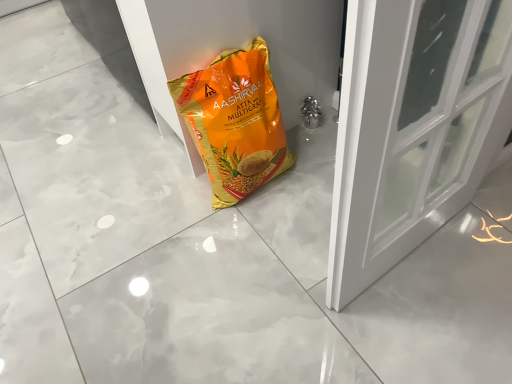
Question: Choose the correct answer: Is orange matte plastic bag at center inside white glossy door at center or outside it?

Choices:
 (A) outside
 (B) inside

Answer: (A)

Question: Considering the positions of orange matte plastic bag at center and white glossy door at center in the image, is orange matte plastic bag at center wider or thinner than white glossy door at center?

Choices:
 (A) wide
 (B) thin

Answer: (B)

Question: In terms of height, does orange matte plastic bag at center look taller or shorter compared to white glossy door at center?

Choices:
 (A) short
 (B) tall

Answer: (B)

Question: Based on their positions, is white glossy door at center located to the left or right of orange matte plastic bag at center?

Choices:
 (A) right
 (B) left

Answer: (A)

Question: From a real-world perspective, is white glossy door at center positioned above or below orange matte plastic bag at center?

Choices:
 (A) below
 (B) above

Answer: (A)

Question: Is white glossy door at center in front of or behind orange matte plastic bag at center in the image?

Choices:
 (A) front
 (B) behind

Answer: (B)

Question: Considering the positions of white glossy door at center and orange matte plastic bag at center in the image, is white glossy door at center taller or shorter than orange matte plastic bag at center?

Choices:
 (A) short
 (B) tall

Answer: (A)